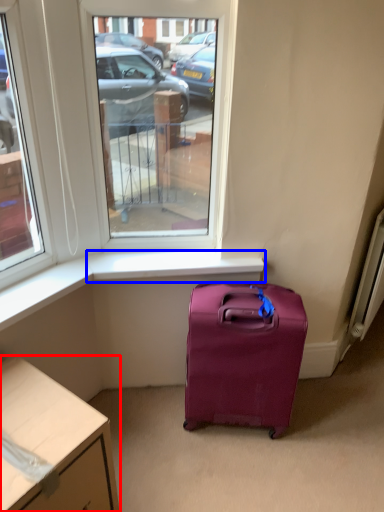
Question: Which of the following is the closest to the observer, desk (highlighted by a red box) or window sill (highlighted by a blue box)?

Choices:
 (A) desk
 (B) window sill

Answer: (A)